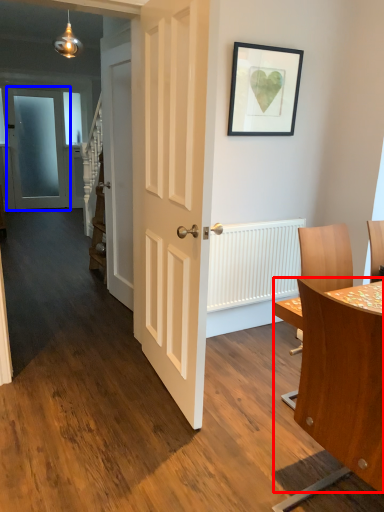
Question: Which object appears closest to the camera in this image, table (highlighted by a red box) or door (highlighted by a blue box)?

Choices:
 (A) table
 (B) door

Answer: (A)